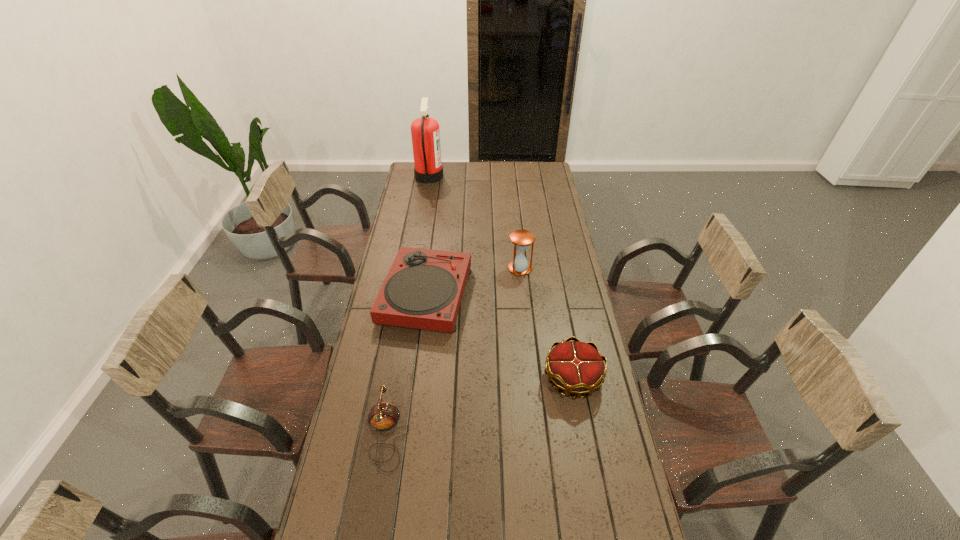
In the image, there is a desktop. Identify the location of vacant region at the far right corner. (525, 163).

Find the location of a particular element. The width and height of the screenshot is (960, 540). free space between the tallest object and the record player is located at coordinates (427, 235).

Where is `vacant area that lies between the crown and the telephone`? Image resolution: width=960 pixels, height=540 pixels. vacant area that lies between the crown and the telephone is located at coordinates (480, 406).

This screenshot has height=540, width=960. I want to click on vacant space that is in between the telephone and the record player, so click(x=406, y=364).

Identify the location of vacant point located between the crown and the record player. tap(499, 336).

Image resolution: width=960 pixels, height=540 pixels. I want to click on free space between the crown and the fire extinguisher, so click(501, 277).

You are a GUI agent. You are given a task and a screenshot of the screen. Output one action in this format:
    pyautogui.click(x=<x>, y=<y>)
    Task: Click on the free spot between the crown and the fire extinguisher
    The width and height of the screenshot is (960, 540).
    Given the screenshot: What is the action you would take?
    pyautogui.click(x=501, y=277)

This screenshot has width=960, height=540. In order to click on empty space between the farthest object and the hourglass in this screenshot , I will do `click(474, 222)`.

You are a GUI agent. You are given a task and a screenshot of the screen. Output one action in this format:
    pyautogui.click(x=<x>, y=<y>)
    Task: Click on the vacant space that is in between the telephone and the record player
    The height and width of the screenshot is (540, 960).
    Given the screenshot: What is the action you would take?
    pyautogui.click(x=406, y=364)

This screenshot has height=540, width=960. I want to click on free area in between the record player and the fourth shortest object, so point(473,281).